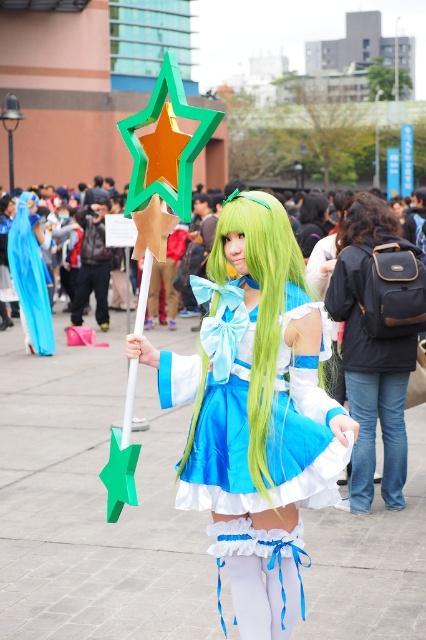
Who is higher up, matte blue dress at center or black leather backpack at right?

black leather backpack at right is above.

Is point (264, 552) positioned after point (399, 474)?

No, (264, 552) is closer to viewer.

At what (x,y) coordinates should I click in order to perform the action: click on matte blue dress at center. Please return your answer as a coordinate pair (x, y). This screenshot has width=426, height=640. Looking at the image, I should click on (256, 412).

Is black leather backpack at right positioned at the back of dark brown curly hair at center?

No, black leather backpack at right is in front of dark brown curly hair at center.

Can you confirm if black leather backpack at right is positioned below dark brown curly hair at center?

Yes.

I want to click on black leather backpack at right, so click(374, 346).

Between green silky hair at center and dark brown curly hair at center, which one has less height?

With less height is dark brown curly hair at center.

Is green silky hair at center bigger than dark brown curly hair at center?

Correct, green silky hair at center is larger in size than dark brown curly hair at center.

Describe the element at coordinates (261, 305) in the screenshot. The height and width of the screenshot is (640, 426). I see `green silky hair at center` at that location.

Find the location of a particular element. green silky hair at center is located at coordinates (261, 305).